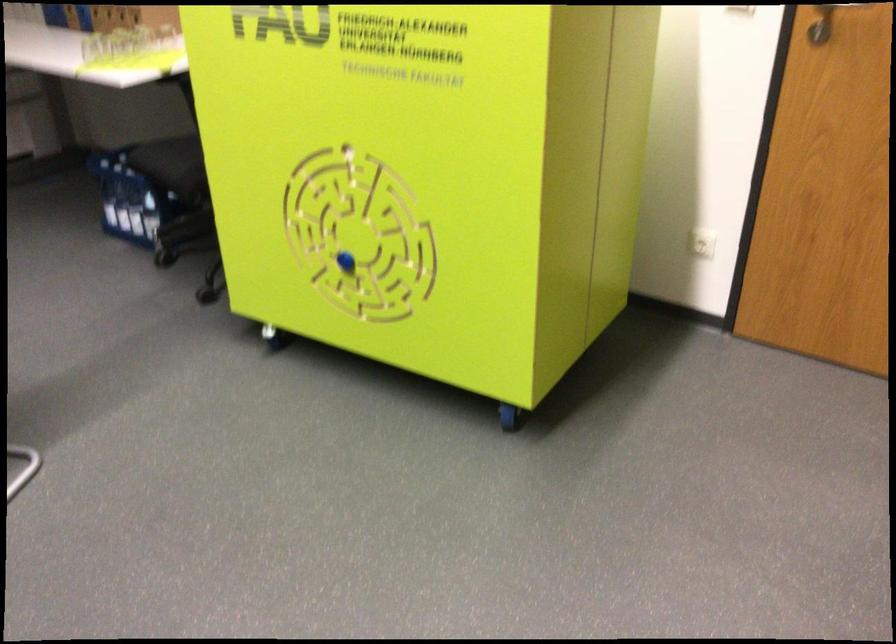
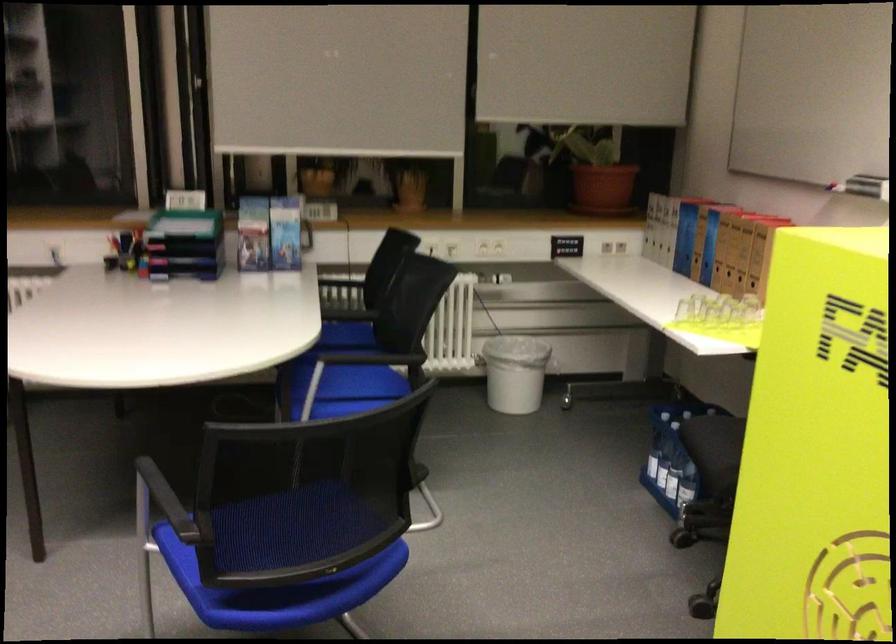
Question: The first image is from the beginning of the video and the second image is from the end. How did the camera likely rotate when shooting the video?

Choices:
 (A) Left
 (B) Right
 (C) Up
 (D) Down

Answer: (A)